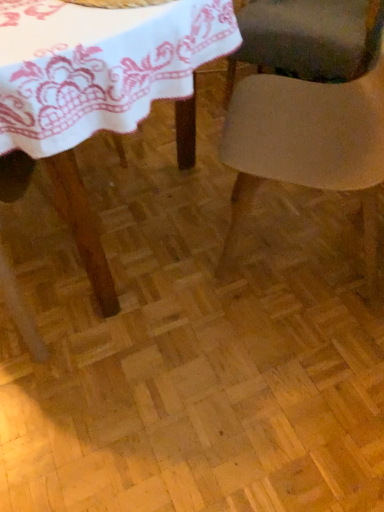
What is the approximate width of smooth beige chair at center, which appears as the second chair when viewed from the back?

It is 20.76 inches.

Locate an element on the screen. white lace tablecloth at upper left is located at coordinates (97, 88).

Where is `matte gray chair at center, the second chair from the front`? matte gray chair at center, the second chair from the front is located at coordinates click(306, 37).

Where is `smooth beige chair at center, which appears as the 1th chair when ordered from the bottom`? This screenshot has width=384, height=512. smooth beige chair at center, which appears as the 1th chair when ordered from the bottom is located at coordinates [310, 139].

Is matte gray chair at center, the 1th chair positioned from the top, thinner than white lace tablecloth at upper left?

Yes, matte gray chair at center, the 1th chair positioned from the top, is thinner than white lace tablecloth at upper left.

From a real-world perspective, is matte gray chair at center, the 1th chair positioned from the top, above or below white lace tablecloth at upper left?

matte gray chair at center, the 1th chair positioned from the top, is below white lace tablecloth at upper left.

Does point (289, 61) come in front of point (7, 123)?

No.

Which is more to the left, white lace tablecloth at upper left or smooth beige chair at center, placed as the second chair when sorted from top to bottom?

white lace tablecloth at upper left.

Looking at this image, does white lace tablecloth at upper left have a lesser width compared to smooth beige chair at center, which appears as the second chair when viewed from the back?

No, white lace tablecloth at upper left is not thinner than smooth beige chair at center, which appears as the second chair when viewed from the back.

Can we say white lace tablecloth at upper left lies outside smooth beige chair at center, the first chair from the front?

Yes, white lace tablecloth at upper left is not within smooth beige chair at center, the first chair from the front.

From the picture: Is smooth beige chair at center, which appears as the 1th chair when ordered from the bottom, at the back of white lace tablecloth at upper left?

Absolutely, white lace tablecloth at upper left is directed away from smooth beige chair at center, which appears as the 1th chair when ordered from the bottom.

Is white lace tablecloth at upper left completely or partially outside of matte gray chair at center, the second chair from the front?

Yes.

Is white lace tablecloth at upper left beside matte gray chair at center, the second chair from the front?

No, white lace tablecloth at upper left is not beside matte gray chair at center, the second chair from the front.

Does point (181, 8) lie behind point (277, 36)?

No, it is in front of (277, 36).

Considering the sizes of white lace tablecloth at upper left and matte gray chair at center, which is counted as the first chair, starting from the back, in the image, is white lace tablecloth at upper left taller or shorter than matte gray chair at center, which is counted as the first chair, starting from the back,?

Clearly, white lace tablecloth at upper left is shorter compared to matte gray chair at center, which is counted as the first chair, starting from the back.

In the scene shown: Is smooth beige chair at center, placed as the second chair when sorted from top to bottom, not within white lace tablecloth at upper left?

Yes, smooth beige chair at center, placed as the second chair when sorted from top to bottom, is not within white lace tablecloth at upper left.

Locate an element on the screen. The width and height of the screenshot is (384, 512). table above the smooth beige chair at center, placed as the second chair when sorted from top to bottom (from the image's perspective) is located at coordinates (97, 88).

What's the angular difference between smooth beige chair at center, which appears as the second chair when viewed from the back, and white lace tablecloth at upper left's facing directions?

They differ by 3.87 degrees in their facing directions.

Is smooth beige chair at center, which appears as the 1th chair when ordered from the bottom, taller than white lace tablecloth at upper left?

Yes.

How many degrees apart are the facing directions of smooth beige chair at center, which appears as the second chair when viewed from the back, and matte gray chair at center, which is the second chair from bottom to top?

The angle between the facing direction of smooth beige chair at center, which appears as the second chair when viewed from the back, and the facing direction of matte gray chair at center, which is the second chair from bottom to top, is 84.9 degrees.

From a real-world perspective, is smooth beige chair at center, which appears as the 1th chair when ordered from the bottom, below matte gray chair at center, which is counted as the first chair, starting from the back?

Incorrect, from a real-world perspective, smooth beige chair at center, which appears as the 1th chair when ordered from the bottom, is higher than matte gray chair at center, which is counted as the first chair, starting from the back.

Which object is further away from the camera taking this photo, smooth beige chair at center, placed as the second chair when sorted from top to bottom, or matte gray chair at center, the 1th chair positioned from the top?

matte gray chair at center, the 1th chair positioned from the top, is further away from the camera.

Where is `chair behind the smooth beige chair at center, which appears as the 1th chair when ordered from the bottom`? chair behind the smooth beige chair at center, which appears as the 1th chair when ordered from the bottom is located at coordinates (306, 37).

Are matte gray chair at center, which is the second chair from bottom to top, and smooth beige chair at center, which appears as the second chair when viewed from the back, making contact?

They are not placed beside each other.

How different are the orientations of matte gray chair at center, the 1th chair positioned from the top, and smooth beige chair at center, placed as the second chair when sorted from top to bottom, in degrees?

84.9 degrees.

Is matte gray chair at center, the second chair from the front, thinner than smooth beige chair at center, placed as the second chair when sorted from top to bottom?

Incorrect, the width of matte gray chair at center, the second chair from the front, is not less than that of smooth beige chair at center, placed as the second chair when sorted from top to bottom.

Is matte gray chair at center, which is the second chair from bottom to top, oriented towards smooth beige chair at center, which appears as the 1th chair when ordered from the bottom?

Yes, matte gray chair at center, which is the second chair from bottom to top, is aimed at smooth beige chair at center, which appears as the 1th chair when ordered from the bottom.

Locate an element on the screen. table located in front of the matte gray chair at center, which is counted as the first chair, starting from the back is located at coordinates (97, 88).

From a real-world perspective, starting from the white lace tablecloth at upper left, which chair is the 1st one below it? Please provide its 2D coordinates.

[(310, 139)]

Considering their positions, is smooth beige chair at center, which appears as the 1th chair when ordered from the bottom, positioned further to matte gray chair at center, the second chair from the front, than white lace tablecloth at upper left?

white lace tablecloth at upper left is positioned further to the anchor matte gray chair at center, the second chair from the front.

From the image, which object appears to be farther from smooth beige chair at center, which appears as the 1th chair when ordered from the bottom, matte gray chair at center, which is counted as the first chair, starting from the back, or white lace tablecloth at upper left?

matte gray chair at center, which is counted as the first chair, starting from the back, is positioned further to the anchor smooth beige chair at center, which appears as the 1th chair when ordered from the bottom.

Estimate the real-world distances between objects in this image. Which object is further from white lace tablecloth at upper left, smooth beige chair at center, which appears as the 1th chair when ordered from the bottom, or matte gray chair at center, which is counted as the first chair, starting from the back?

Among the two, matte gray chair at center, which is counted as the first chair, starting from the back, is located further to white lace tablecloth at upper left.

From the image, which object appears to be farther from matte gray chair at center, the 1th chair positioned from the top, white lace tablecloth at upper left or smooth beige chair at center, placed as the second chair when sorted from top to bottom?

white lace tablecloth at upper left is further to matte gray chair at center, the 1th chair positioned from the top.

Based on their spatial positions, is white lace tablecloth at upper left or matte gray chair at center, the second chair from the front, closer to smooth beige chair at center, placed as the second chair when sorted from top to bottom?

white lace tablecloth at upper left lies closer to smooth beige chair at center, placed as the second chair when sorted from top to bottom, than the other object.

Looking at the image, which one is located closer to white lace tablecloth at upper left, matte gray chair at center, which is the second chair from bottom to top, or smooth beige chair at center, which appears as the second chair when viewed from the back?

smooth beige chair at center, which appears as the second chair when viewed from the back, lies closer to white lace tablecloth at upper left than the other object.

The height and width of the screenshot is (512, 384). I want to click on chair between white lace tablecloth at upper left and matte gray chair at center, the 1th chair positioned from the top, in the front-back direction, so click(310, 139).